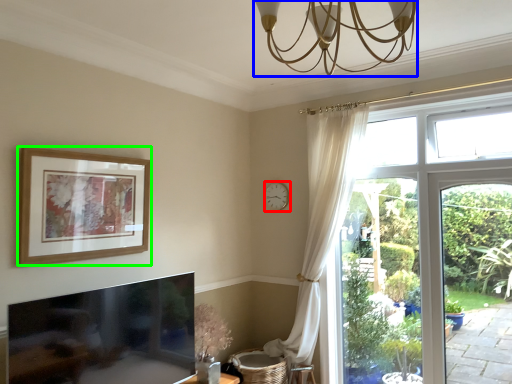
Question: Based on their relative distances, which object is nearer to clock (highlighted by a red box)? Choose from light fixture (highlighted by a blue box) and picture frame (highlighted by a green box).

Choices:
 (A) light fixture
 (B) picture frame

Answer: (B)